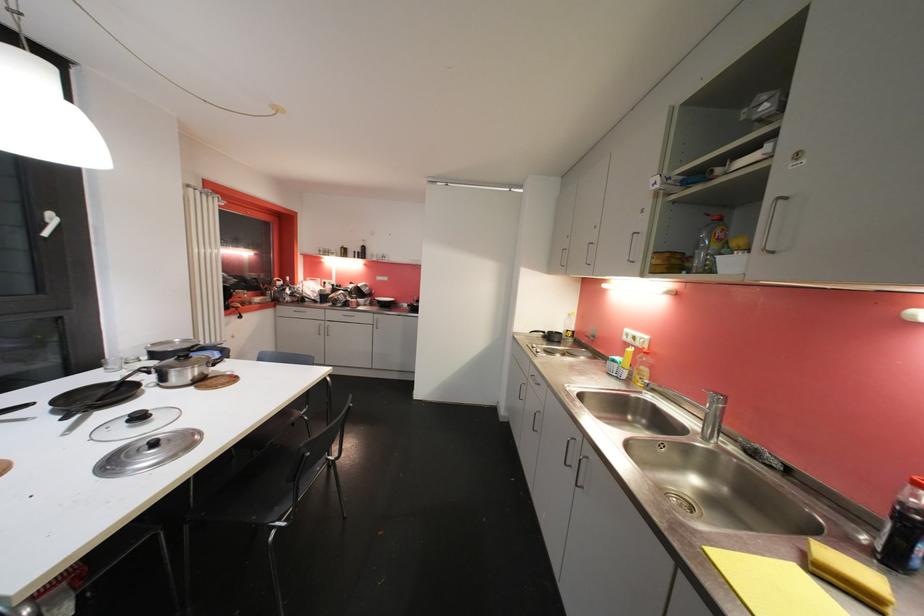
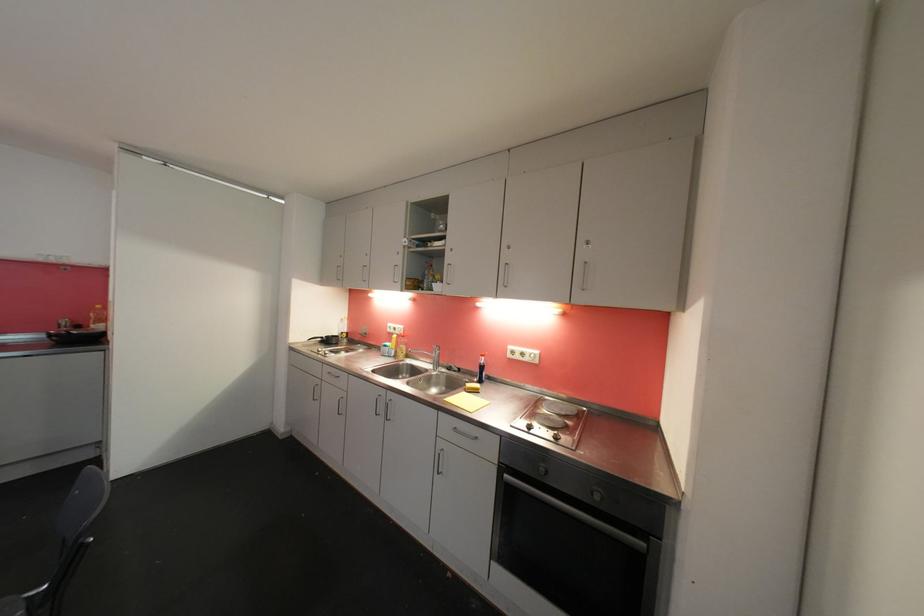
Find the pixel in the second image that matches the point at 541,376 in the first image.

(336, 371)